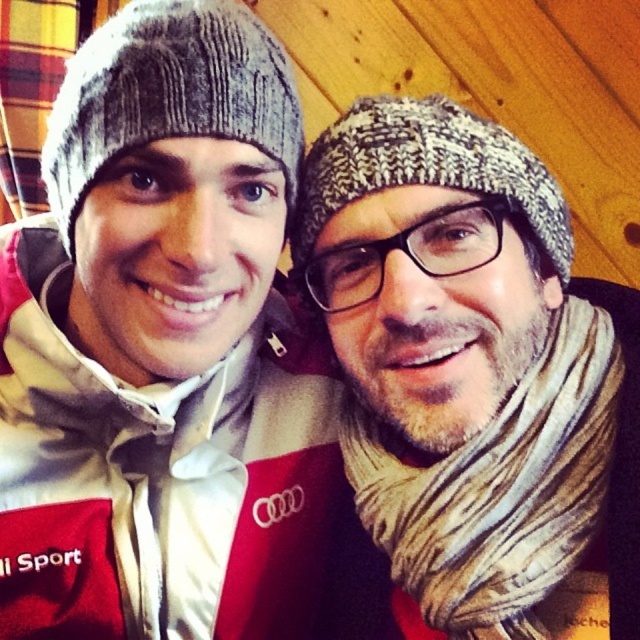
Between striped wool scarf at right and gray knitted beanie at upper left, which one has less height?

With less height is gray knitted beanie at upper left.

Which is in front, point (381, 531) or point (138, 138)?

Point (138, 138)

Does point (522, 499) come in front of point (58, 164)?

That is True.

Locate an element on the screen. striped wool scarf at right is located at coordinates (499, 488).

Who is positioned more to the left, gray knitted beanie at upper left or knitted gray hat at center?

gray knitted beanie at upper left

Is point (285, 156) in front of point (454, 176)?

No, it is not.

This screenshot has width=640, height=640. Find the location of `gray knitted beanie at upper left`. gray knitted beanie at upper left is located at coordinates (168, 93).

Between striped wool scarf at right and knitted gray hat at center, which one appears on the left side from the viewer's perspective?

From the viewer's perspective, knitted gray hat at center appears more on the left side.

At what (x,y) coordinates should I click in order to perform the action: click on striped wool scarf at right. Please return your answer as a coordinate pair (x, y). The width and height of the screenshot is (640, 640). Looking at the image, I should click on (499, 488).

This screenshot has width=640, height=640. In order to click on striped wool scarf at right in this screenshot , I will do `click(499, 488)`.